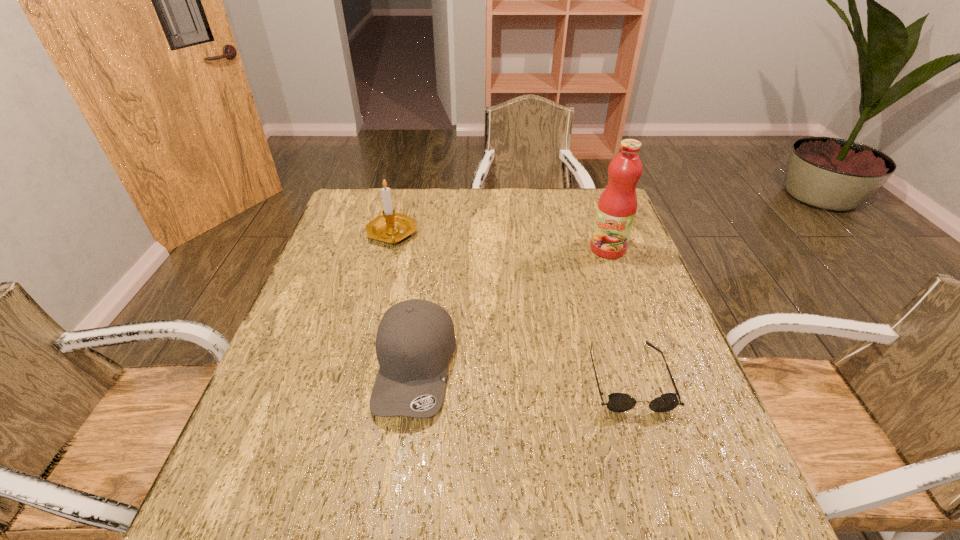
The image size is (960, 540). Identify the location of vacant spot on the desktop that is between the baseball cap and the shortest object and is positioned on the front label of the fruit juice. (538, 372).

Where is `free spot on the desktop that is between the baseball cap and the shortest object and is positioned with a handle on the candle holder`? The image size is (960, 540). free spot on the desktop that is between the baseball cap and the shortest object and is positioned with a handle on the candle holder is located at coordinates (531, 372).